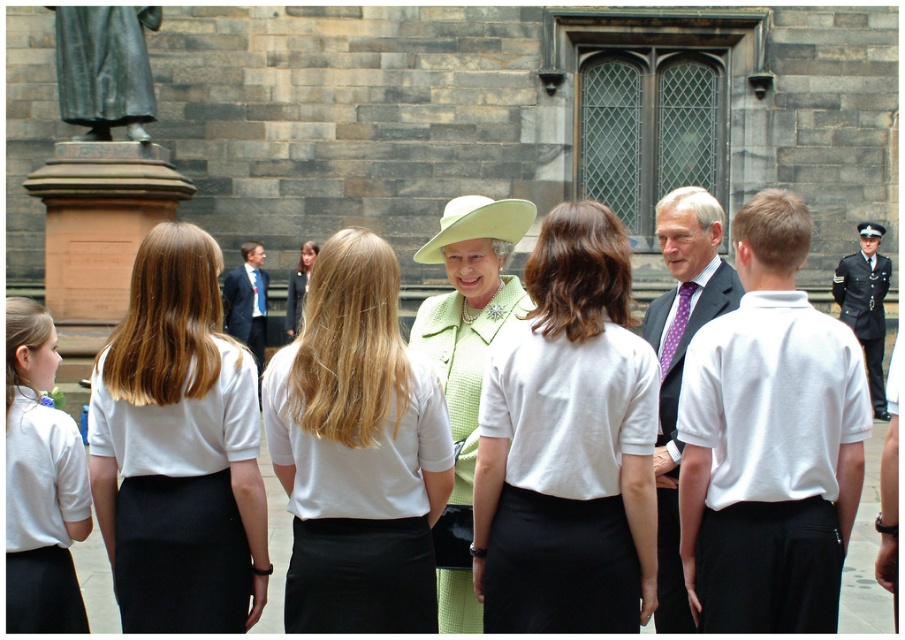
Question: Which object is farther from the camera taking this photo?

Choices:
 (A) bronze statue at left
 (B) matte blue suit at center

Answer: (B)

Question: Which object is closer to the camera taking this photo?

Choices:
 (A) matte blue suit at center
 (B) white fabric hat at center

Answer: (B)

Question: Can you confirm if white fabric shirt at center is positioned below white fabric shirt at left?

Choices:
 (A) yes
 (B) no

Answer: (A)

Question: Estimate the real-world distances between objects in this image. Which object is closer to the bronze statue at left?

Choices:
 (A) matte purple tie at right
 (B) white fabric uniform at center
 (C) matte blue suit at center

Answer: (C)

Question: Does light green fabric dress at center have a larger size compared to light green textured dress at center?

Choices:
 (A) no
 (B) yes

Answer: (A)

Question: Is light green fabric dress at center wider than white fabric shirt at left?

Choices:
 (A) yes
 (B) no

Answer: (A)